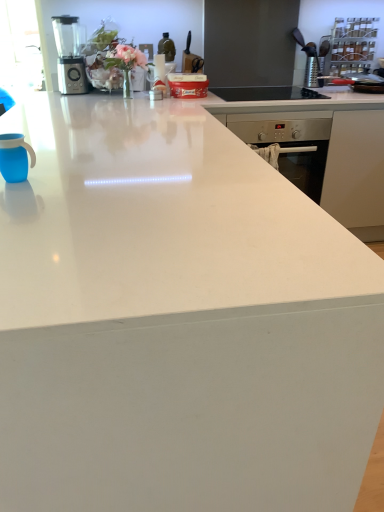
Question: Does point (233, 96) appear closer or farther from the camera than point (72, 80)?

Choices:
 (A) farther
 (B) closer

Answer: (B)

Question: In terms of width, does black glass gas stove at upper center look wider or thinner when compared to metallic silver blender at upper left?

Choices:
 (A) wide
 (B) thin

Answer: (A)

Question: Which of these objects is positioned closest to the black glass gas stove at upper center?

Choices:
 (A) metallic silver blender at upper left
 (B) blue matte mug at left

Answer: (A)

Question: Which object is positioned closest to the black glass gas stove at upper center?

Choices:
 (A) metallic silver blender at upper left
 (B) blue matte mug at left

Answer: (A)